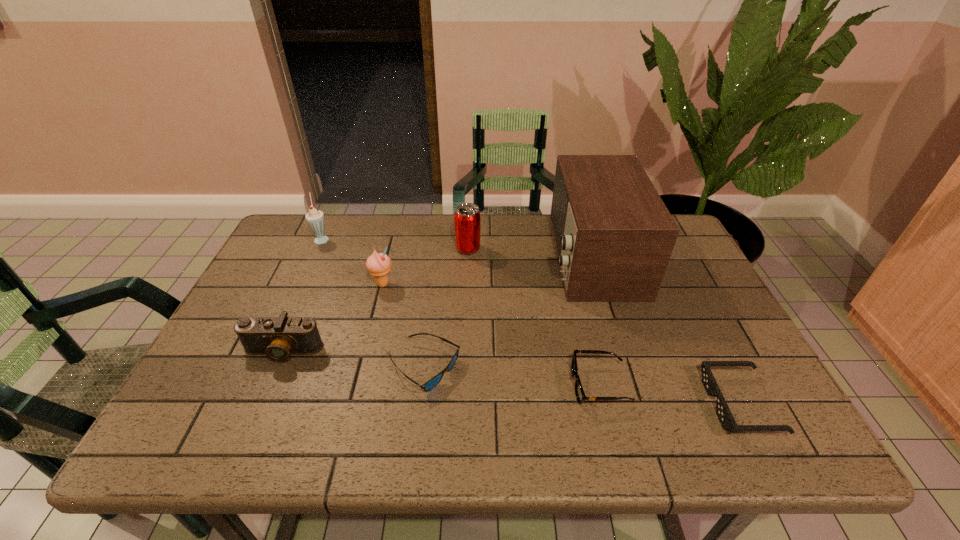
At what (x,y) coordinates should I click in order to perform the action: click on free space between the camera and the rightmost object. Please return your answer as a coordinate pair (x, y). Looking at the image, I should click on (512, 377).

The height and width of the screenshot is (540, 960). What are the coordinates of `unoccupied position between the milkshake and the rightmost object` in the screenshot? It's located at (531, 321).

Where is `vacant space that is in between the fourth tallest object and the soda can`? This screenshot has width=960, height=540. vacant space that is in between the fourth tallest object and the soda can is located at coordinates (425, 266).

At what (x,y) coordinates should I click in order to perform the action: click on free space between the leftmost sunglasses and the icecream. Please return your answer as a coordinate pair (x, y). The image size is (960, 540). Looking at the image, I should click on (403, 326).

This screenshot has width=960, height=540. In order to click on free spot between the third object from left to right and the leftmost sunglasses in this screenshot , I will do `click(403, 326)`.

Locate an element on the screen. The width and height of the screenshot is (960, 540). blank region between the third object from left to right and the fifth tallest object is located at coordinates (332, 318).

Point out which object is positioned as the fourth nearest to the leftmost sunglasses. Please provide its 2D coordinates. Your answer should be formatted as a tuple, i.e. [(x, y)], where the tuple contains the x and y coordinates of a point satisfying the conditions above.

[(614, 236)]

Identify the location of the sixth closest object to the camera. This screenshot has height=540, width=960. (614, 236).

Locate which sunglasses is the closest to the icecream. Please provide its 2D coordinates. Your answer should be formatted as a tuple, i.e. [(x, y)], where the tuple contains the x and y coordinates of a point satisfying the conditions above.

[(429, 385)]

Identify which sunglasses is located as the second nearest to the leftmost sunglasses. Please provide its 2D coordinates. Your answer should be formatted as a tuple, i.e. [(x, y)], where the tuple contains the x and y coordinates of a point satisfying the conditions above.

[(727, 421)]